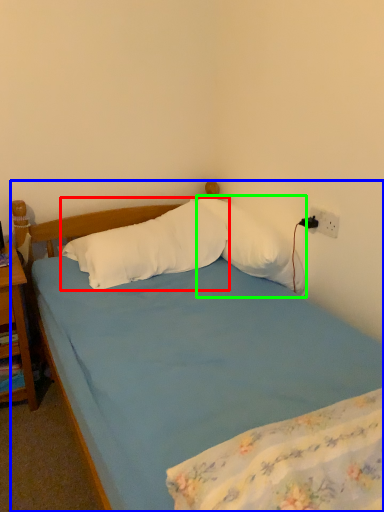
Question: Estimate the real-world distances between objects in this image. Which object is farther from pillow (highlighted by a red box), bed (highlighted by a blue box) or pillow (highlighted by a green box)?

Choices:
 (A) bed
 (B) pillow

Answer: (B)